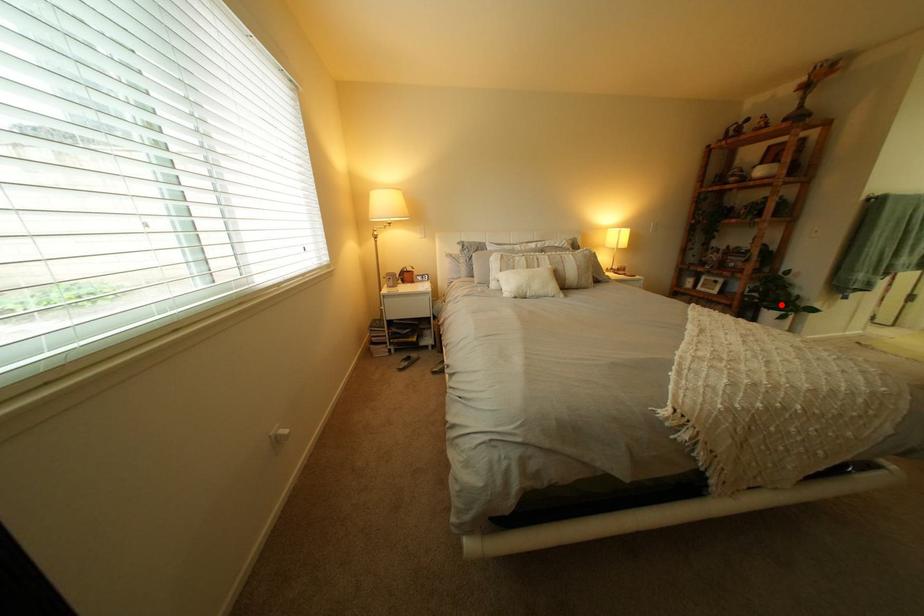
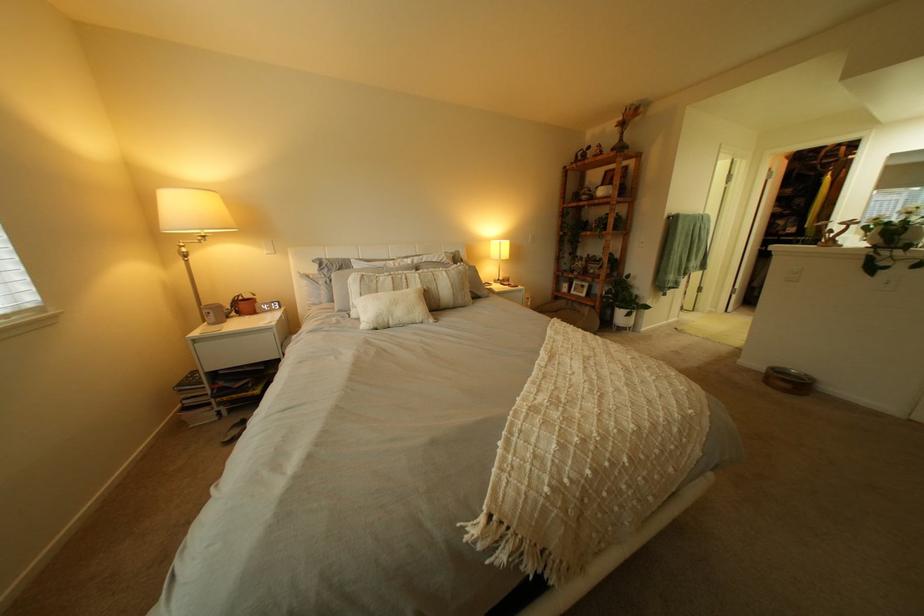
Question: I am providing you with two images of the same scene from different viewpoints. Image1 has a red point marked. In image2, the corresponding 3D location appears at what relative position? Reply with the corresponding letter.

Choices:
 (A) Closer
 (B) Farther

Answer: (A)